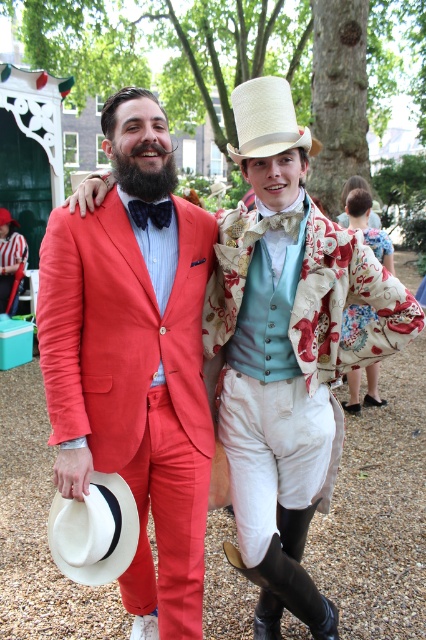
You are a photographer setting up a shoot in a garden. You have two props to place in the scene according to the image description. The first prop is a red velvet cushion, and the second is a silver tray. The matte red suit at left needs to be placed on the right side of the white felt cowboy hat at lower left. Where should you position the red velvet cushion and the silver tray relative to the existing objects?

The matte red suit at left is positioned on the right side of the white felt cowboy hat at lower left. Therefore, the red velvet cushion should be placed to the right of the white felt cowboy hat at lower left, aligning with the position of the matte red suit at left. The silver tray should be placed to the left of the white felt cowboy hat at lower left to maintain balance in the composition.

You are a photographer setting up for a group photo in the garden. You need to ensure that the white felt cowboy hat at lower left and the white straw cowboy hat at upper center are both visible in the frame. Based on their positions, which hat is located lower in the image?

The white felt cowboy hat at lower left is located lower in the image than the white straw cowboy hat at upper center.

You are a photographer setting up a shoot in a garden. You have two props to place in the scene according to the image description. The first prop is a red ribbon that needs to be placed on the left side of the white felt cowboy hat at lower left. The second prop is a blue ribbon that must be placed on the right side of the velvet bow tie at center. Based on the image, will the red ribbon be to the left or right of the blue ribbon?

The white felt cowboy hat at lower left is positioned on the left side of the velvet bow tie at center. Therefore, placing the red ribbon to the left of the white felt cowboy hat at lower left would place it further to the left, while the blue ribbon on the right side of the velvet bow tie at center would be to the right. Thus, the red ribbon will be to the left of the blue ribbon.